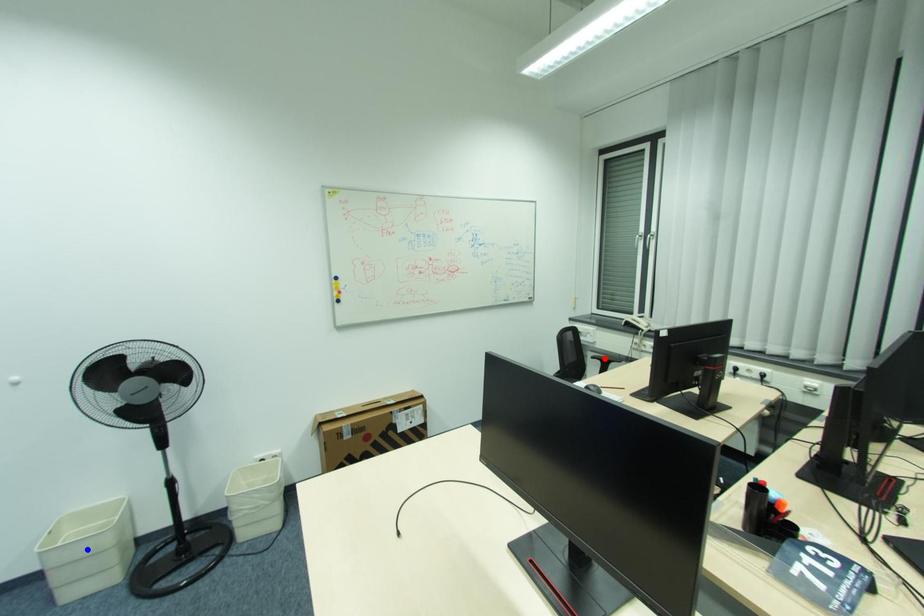
Question: In the image, two points are highlighted. Which point is nearer to the camera? Reply with the corresponding letter.

Choices:
 (A) blue point
 (B) red point

Answer: (A)